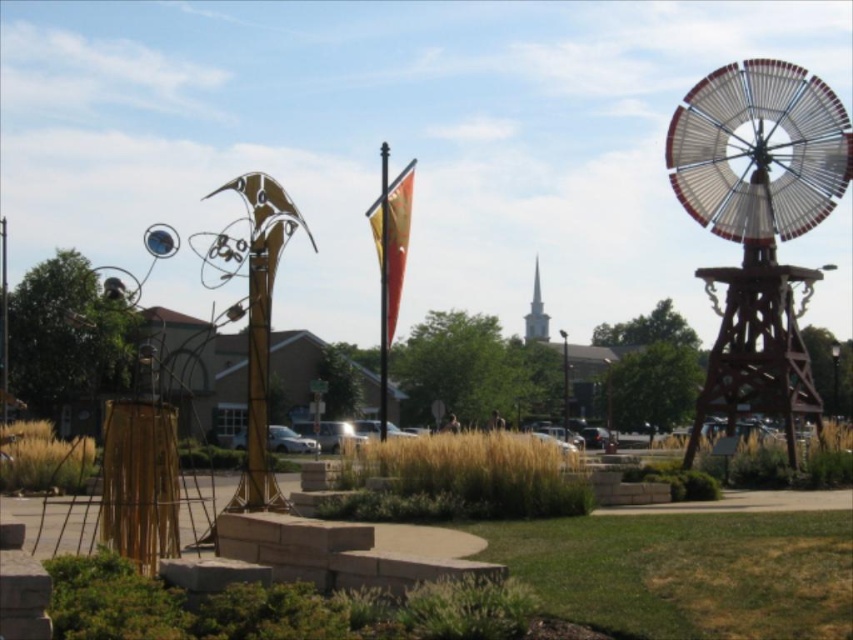
Question: Among these objects, which one is farthest from the camera?

Choices:
 (A) white steeple at center
 (B) metallic flagpole at center
 (C) wooden windmill at right
 (D) orange fabric flag at center

Answer: (A)

Question: Estimate the real-world distances between objects in this image. Which object is closer to the orange fabric flag at center?

Choices:
 (A) wooden windmill at right
 (B) metallic flagpole at center
 (C) white steeple at center

Answer: (B)

Question: Is orange fabric flag at center smaller than metallic flagpole at center?

Choices:
 (A) yes
 (B) no

Answer: (A)

Question: Considering the real-world distances, which object is farthest from the orange fabric flag at center?

Choices:
 (A) wooden windmill at right
 (B) white steeple at center
 (C) metallic flagpole at center

Answer: (B)

Question: In this image, where is wooden windmill at right located relative to metallic flagpole at center?

Choices:
 (A) below
 (B) above

Answer: (B)

Question: In this image, where is wooden windmill at right located relative to metallic flagpole at center?

Choices:
 (A) below
 (B) above

Answer: (B)